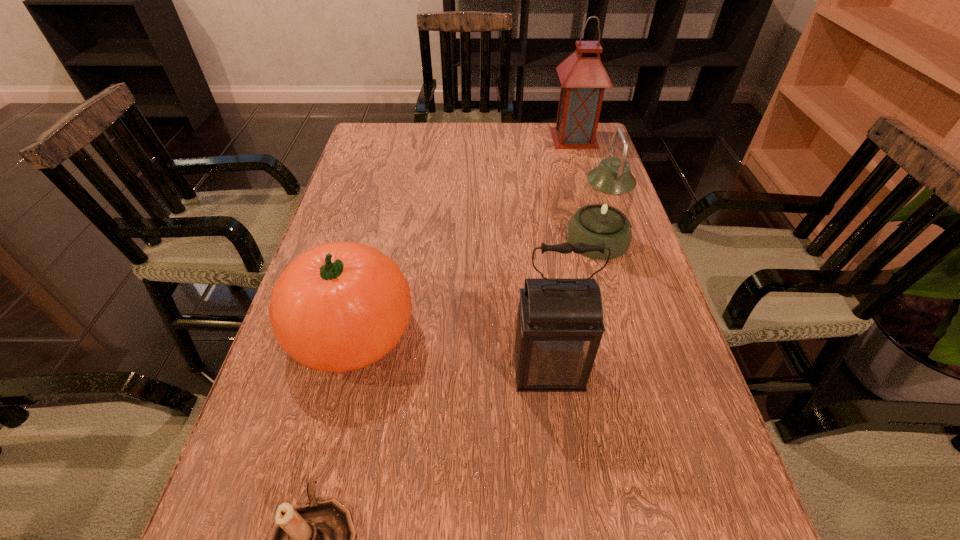
Find the location of a particular element. the farthest object is located at coordinates (583, 78).

Locate an element on the screen. the leftmost lantern is located at coordinates (558, 327).

Where is `the nearest lantern`? This screenshot has width=960, height=540. the nearest lantern is located at coordinates (558, 327).

Identify the location of the second nearest lantern. (606, 201).

Where is `pumpkin`? pumpkin is located at coordinates (340, 306).

This screenshot has height=540, width=960. I want to click on vacant area located 0.260m on the left of the farthest object, so click(468, 138).

This screenshot has width=960, height=540. I want to click on free space located 0.160m on the front-facing side of the leftmost lantern, so click(564, 496).

Locate an element on the screen. The height and width of the screenshot is (540, 960). vacant space located on the front of the second farthest lantern is located at coordinates click(x=643, y=402).

Locate an element on the screen. free space located 0.180m on the right of the pumpkin is located at coordinates (509, 333).

The height and width of the screenshot is (540, 960). In order to click on object located at the far edge in this screenshot , I will do `click(583, 78)`.